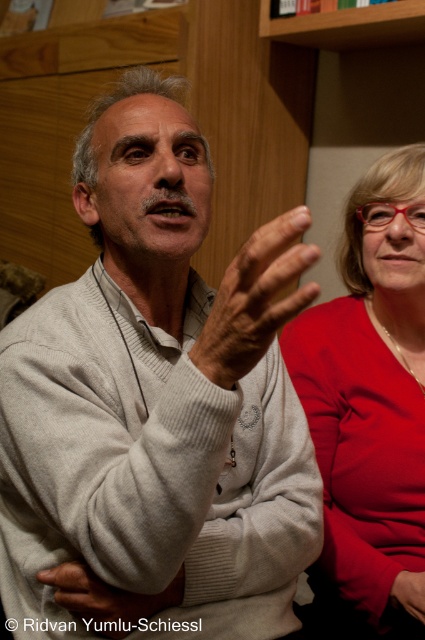
Can you confirm if light gray knitted sweater at center is positioned to the right of matte skin hand at center?

Incorrect, light gray knitted sweater at center is not on the right side of matte skin hand at center.

Who is more forward, (112, 374) or (397, 580)?

Point (112, 374)

Where is `light gray knitted sweater at center`? This screenshot has width=425, height=640. light gray knitted sweater at center is located at coordinates pos(158,400).

Is light gray knitted sweater at center shorter than matte red blouse at right?

Correct, light gray knitted sweater at center is not as tall as matte red blouse at right.

This screenshot has height=640, width=425. What do you see at coordinates (158, 400) in the screenshot?
I see `light gray knitted sweater at center` at bounding box center [158, 400].

Is point (87, 397) positioned before point (320, 348)?

That is True.

Find the location of a particular element. This screenshot has width=425, height=640. light gray knitted sweater at center is located at coordinates (158, 400).

Describe the element at coordinates (107, 598) in the screenshot. I see `smooth beige hand at center` at that location.

Who is higher up, smooth beige hand at center or matte skin hand at center?

smooth beige hand at center is above.

The height and width of the screenshot is (640, 425). What do you see at coordinates (107, 598) in the screenshot?
I see `smooth beige hand at center` at bounding box center [107, 598].

Identify the location of smooth beige hand at center. (107, 598).